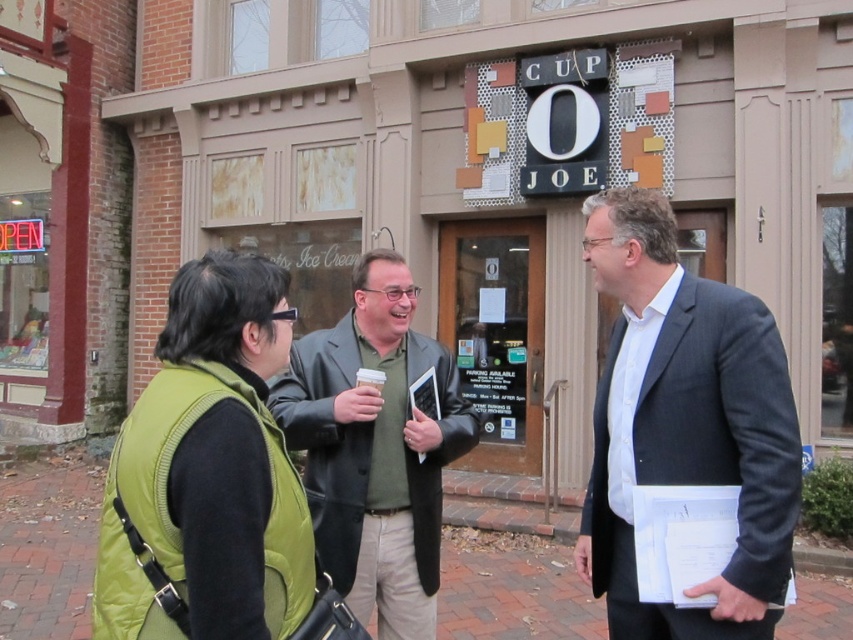
Does point (358, 362) lie in front of point (807, 602)?

Yes, it is.

Is green fabric jacket at center shorter than brick pavement at lower center?

No, green fabric jacket at center is not shorter than brick pavement at lower center.

This screenshot has width=853, height=640. What are the coordinates of `green fabric jacket at center` in the screenshot? It's located at (375, 449).

You are a GUI agent. You are given a task and a screenshot of the screen. Output one action in this format:
    pyautogui.click(x=<x>, y=<y>)
    Task: Click on the green fabric jacket at center
    
    Given the screenshot: What is the action you would take?
    pyautogui.click(x=375, y=449)

Does green quilted vest at lower left have a greater width compared to green fabric jacket at center?

Incorrect, green quilted vest at lower left's width does not surpass green fabric jacket at center's.

Does point (183, 384) lie behind point (402, 323)?

No.

The width and height of the screenshot is (853, 640). I want to click on green quilted vest at lower left, so click(x=209, y=468).

Can you confirm if dark gray suit at center is bigger than brick pavement at lower center?

Yes.

Consider the image. Does dark gray suit at center appear under brick pavement at lower center?

No.

Which is behind, point (769, 332) or point (819, 580)?

Positioned behind is point (819, 580).

Identify the location of dark gray suit at center. (685, 424).